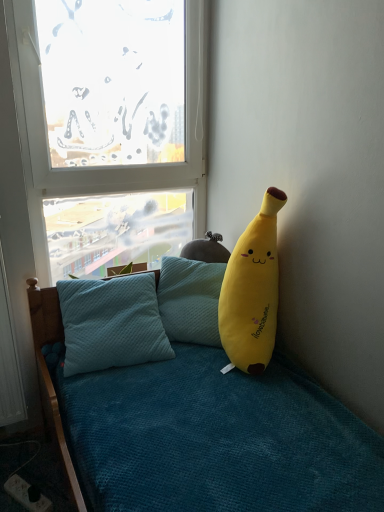
This screenshot has height=512, width=384. What do you see at coordinates (27, 494) in the screenshot?
I see `black plastic power outlet at lower left` at bounding box center [27, 494].

At what (x,y) coordinates should I click in order to perform the action: click on yellow plush at right. Please return your answer as a coordinate pair (x, y). The height and width of the screenshot is (512, 384). Looking at the image, I should click on (252, 291).

The image size is (384, 512). What do you see at coordinates (252, 291) in the screenshot? I see `yellow plush at right` at bounding box center [252, 291].

At what (x,y) coordinates should I click in order to perform the action: click on transparent glass window at upper left. Please return your answer as a coordinate pair (x, y). Looking at the image, I should click on (105, 166).

From the image's perspective, between yellow plush at right and transparent glass window at upper left, which one is located above?

From the image's view, transparent glass window at upper left is above.

Locate an element on the screen. This screenshot has height=512, width=384. window that is behind the yellow plush at right is located at coordinates (105, 166).

From a real-world perspective, who is located higher, yellow plush at right or transparent glass window at upper left?

transparent glass window at upper left, from a real-world perspective.

Is yellow plush at right not near transparent glass window at upper left?

Actually, yellow plush at right and transparent glass window at upper left are a little close together.

From the image's perspective, which is below, black plastic power outlet at lower left or yellow plush at right?

black plastic power outlet at lower left, from the image's perspective.

What's the angular difference between black plastic power outlet at lower left and yellow plush at right's facing directions?

The angular difference between black plastic power outlet at lower left and yellow plush at right is 68.6 degrees.

Is black plastic power outlet at lower left oriented towards yellow plush at right?

No, black plastic power outlet at lower left is not oriented towards yellow plush at right.

Is black plastic power outlet at lower left closer to camera compared to yellow plush at right?

No, the depth of black plastic power outlet at lower left is greater than that of yellow plush at right.

Locate an element on the screen. banana that appears above the black plastic power outlet at lower left (from the image's perspective) is located at coordinates (252, 291).

Is yellow plush at right bigger or smaller than black plastic power outlet at lower left?

In the image, yellow plush at right appears to be larger than black plastic power outlet at lower left.

How much distance is there between yellow plush at right and black plastic power outlet at lower left?

A: yellow plush at right is 1.06 meters away from black plastic power outlet at lower left.

Is yellow plush at right positioned far away from black plastic power outlet at lower left?

Indeed, yellow plush at right is not near black plastic power outlet at lower left.

What's the angular difference between black plastic power outlet at lower left and transparent glass window at upper left's facing directions?

28.3 degrees.

From the image's perspective, who appears lower, black plastic power outlet at lower left or transparent glass window at upper left?

black plastic power outlet at lower left appears lower in the image.

Considering the sizes of objects black plastic power outlet at lower left and transparent glass window at upper left in the image provided, who is taller, black plastic power outlet at lower left or transparent glass window at upper left?

transparent glass window at upper left.

Is there a large distance between black plastic power outlet at lower left and transparent glass window at upper left?

Yes, black plastic power outlet at lower left and transparent glass window at upper left are quite far apart.

Does transparent glass window at upper left touch yellow plush at right?

No.

Considering the sizes of objects transparent glass window at upper left and yellow plush at right in the image provided, who is bigger, transparent glass window at upper left or yellow plush at right?

transparent glass window at upper left.

Where is `banana that appears below the transparent glass window at upper left (from the image's perspective)`? This screenshot has height=512, width=384. banana that appears below the transparent glass window at upper left (from the image's perspective) is located at coordinates (252, 291).

Is transparent glass window at upper left placed right next to black plastic power outlet at lower left?

No.

Is point (146, 176) farther from viewer compared to point (15, 499)?

Yes, point (146, 176) is behind point (15, 499).

At what (x,y) coordinates should I click in order to perform the action: click on power outlet lying in front of the transparent glass window at upper left. Please return your answer as a coordinate pair (x, y). This screenshot has height=512, width=384. Looking at the image, I should click on (27, 494).

Could you measure the distance between transparent glass window at upper left and black plastic power outlet at lower left?

transparent glass window at upper left and black plastic power outlet at lower left are 1.31 meters apart.

This screenshot has height=512, width=384. I want to click on banana below the transparent glass window at upper left (from a real-world perspective), so click(x=252, y=291).

Where is `banana on the right of black plastic power outlet at lower left`? The height and width of the screenshot is (512, 384). banana on the right of black plastic power outlet at lower left is located at coordinates (252, 291).

From the image, which object appears to be farther from transparent glass window at upper left, yellow plush at right or black plastic power outlet at lower left?

black plastic power outlet at lower left is further to transparent glass window at upper left.

Considering their positions, is yellow plush at right positioned closer to black plastic power outlet at lower left than transparent glass window at upper left?

yellow plush at right is closer to black plastic power outlet at lower left.

When comparing their distances from yellow plush at right, does transparent glass window at upper left or black plastic power outlet at lower left seem closer?

transparent glass window at upper left is positioned closer to the anchor yellow plush at right.

Estimate the real-world distances between objects in this image. Which object is closer to transparent glass window at upper left, black plastic power outlet at lower left or yellow plush at right?

The object closer to transparent glass window at upper left is yellow plush at right.

Considering their positions, is black plastic power outlet at lower left positioned further to yellow plush at right than transparent glass window at upper left?

Among the two, black plastic power outlet at lower left is located further to yellow plush at right.

Considering their positions, is transparent glass window at upper left positioned closer to black plastic power outlet at lower left than yellow plush at right?

yellow plush at right lies closer to black plastic power outlet at lower left than the other object.

Find the location of a particular element. The image size is (384, 512). banana between transparent glass window at upper left and black plastic power outlet at lower left from top to bottom is located at coordinates (252, 291).